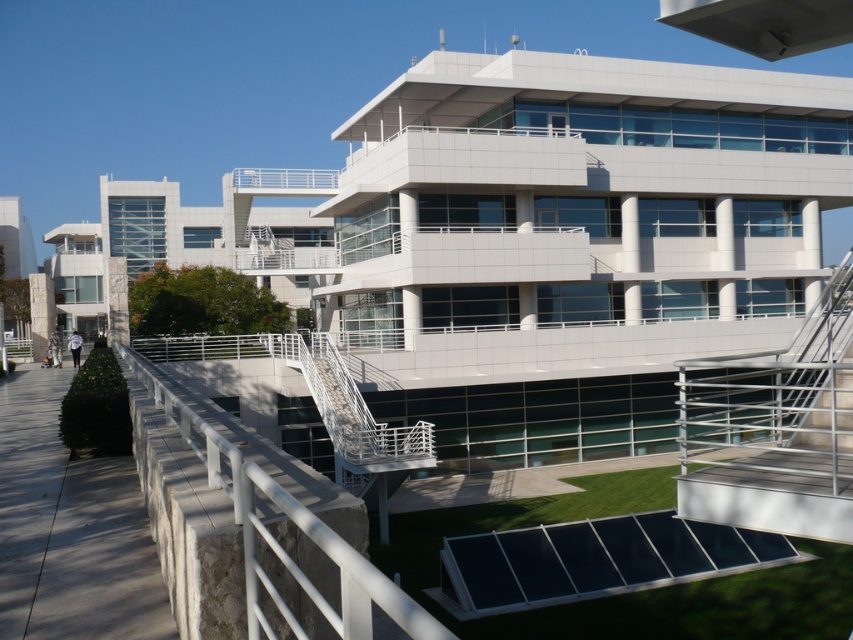
Question: Is white metal/rail at center to the left of metallic silver stairs at center-right from the viewer's perspective?

Choices:
 (A) no
 (B) yes

Answer: (B)

Question: Observing the image, what is the correct spatial positioning of white metal/rail at center in reference to metallic silver stairs at center-right?

Choices:
 (A) left
 (B) right

Answer: (A)

Question: Can you confirm if white metal/rail at center is thinner than metallic silver stairs at center-right?

Choices:
 (A) yes
 (B) no

Answer: (A)

Question: Which object appears farthest from the camera in this image?

Choices:
 (A) metallic silver stairs at center-right
 (B) white metal/rail at center

Answer: (A)